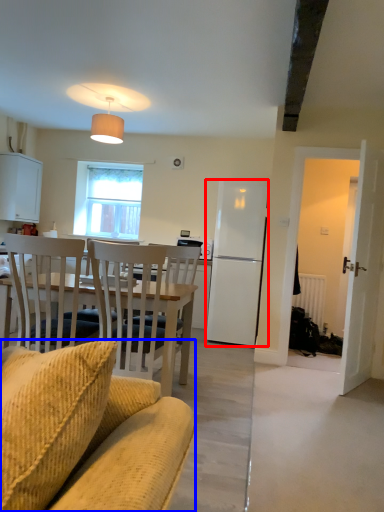
Question: Which of the following is the closest to the observer, refrigerator (highlighted by a red box) or chair (highlighted by a blue box)?

Choices:
 (A) refrigerator
 (B) chair

Answer: (B)